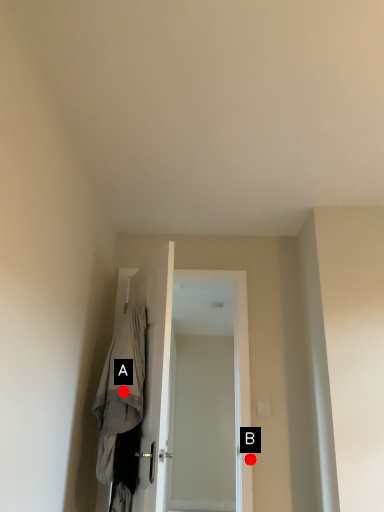
Question: Two points are circled on the image, labeled by A and B beside each circle. Which of the following is the farthest from the observer?

Choices:
 (A) A is further
 (B) B is further

Answer: (B)